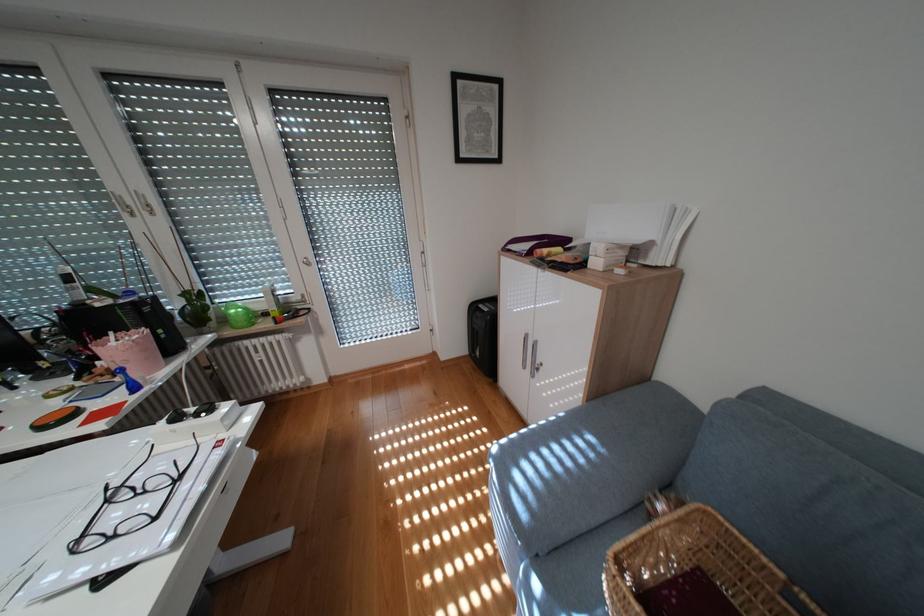
Where would you lift the small white box? Please return your answer as a coordinate pair (x, y).

(609, 249)